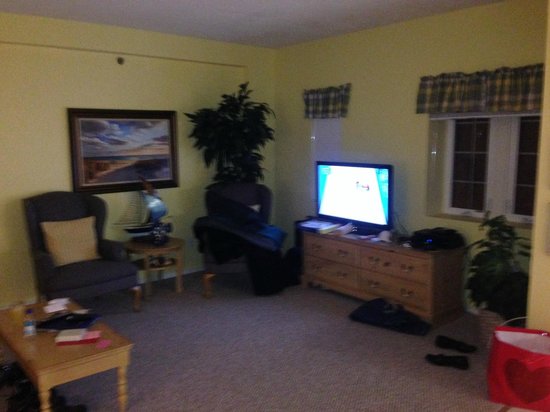
The width and height of the screenshot is (550, 412). In order to click on television in this screenshot , I will do `click(346, 190)`.